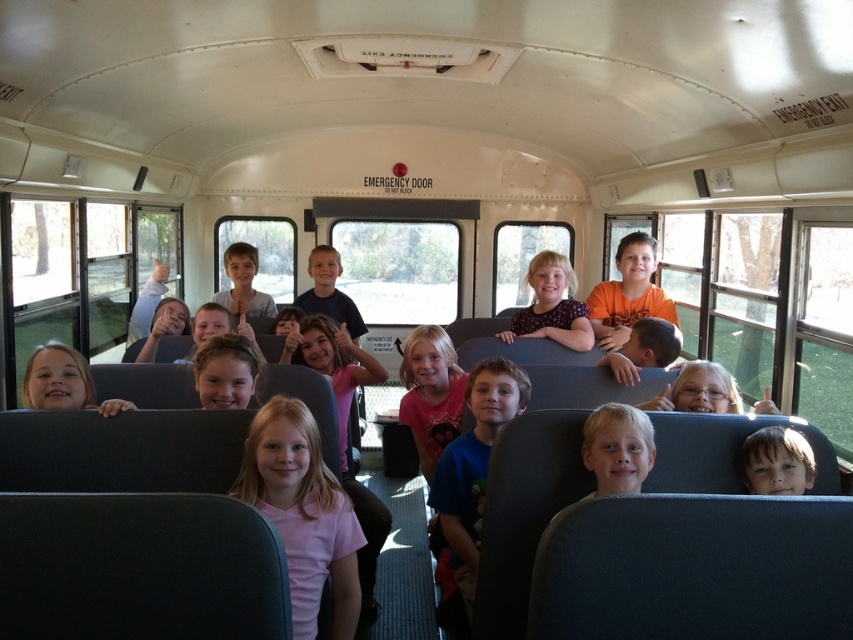
Is blue cotton shirt at center closer to camera compared to matte white shirt at center?

That is True.

Who is taller, blue cotton shirt at center or matte white shirt at center?

blue cotton shirt at center

Find the location of a particular element. blue cotton shirt at center is located at coordinates (473, 468).

Who is higher up, pink matte shirt at lower center or matte white shirt at center?

matte white shirt at center is above.

Does pink matte shirt at lower center have a greater height compared to matte white shirt at center?

Correct, pink matte shirt at lower center is much taller as matte white shirt at center.

Is point (329, 540) positioned behind point (228, 301)?

No.

This screenshot has height=640, width=853. Identify the location of pink matte shirt at lower center. (303, 513).

Does point (347, 602) lie behind point (641, 413)?

No, (347, 602) is in front of (641, 413).

You are a GUI agent. You are given a task and a screenshot of the screen. Output one action in this format:
    pyautogui.click(x=<x>, y=<y>)
    Task: Click on the pink matte shirt at lower center
    
    Given the screenshot: What is the action you would take?
    pyautogui.click(x=303, y=513)

Which is in front, point (236, 492) or point (596, 449)?

Point (596, 449) is more forward.

Where is `pink matte shirt at lower center`? This screenshot has height=640, width=853. pink matte shirt at lower center is located at coordinates (303, 513).